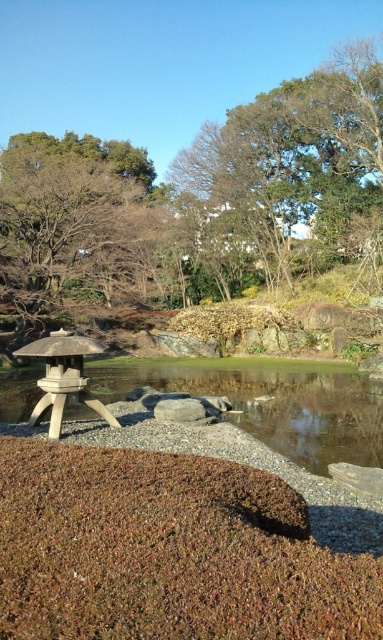
Question: Which of the following is the farthest from the observer?

Choices:
 (A) stone lantern at lower left
 (B) smooth gray rock at center
 (C) brown textured tree at upper center
 (D) clear water at center

Answer: (C)

Question: Considering the relative positions of clear water at center and stone lantern at lower left in the image provided, where is clear water at center located with respect to stone lantern at lower left?

Choices:
 (A) above
 (B) below

Answer: (B)

Question: Which point is closer to the camera taking this photo?

Choices:
 (A) (189, 410)
 (B) (83, 390)

Answer: (B)

Question: From the image, what is the correct spatial relationship of clear water at center in relation to smooth gray rock at center?

Choices:
 (A) left
 (B) right

Answer: (A)

Question: Which of the following is the farthest from the observer?

Choices:
 (A) (50, 400)
 (B) (189, 420)
 (C) (127, 371)
 (D) (80, 221)

Answer: (D)

Question: Can you confirm if clear water at center is smaller than stone lantern at lower left?

Choices:
 (A) no
 (B) yes

Answer: (A)